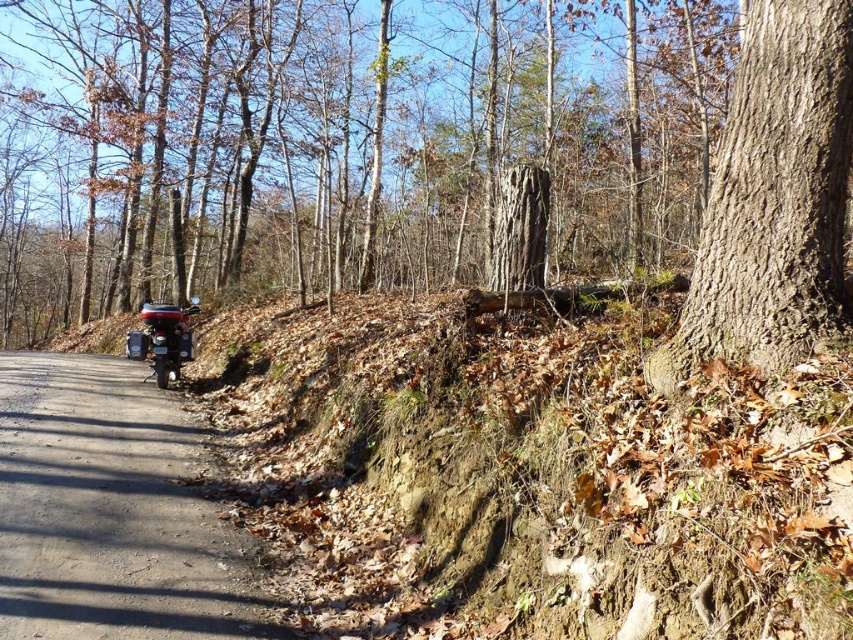
You are a hiker who needs to cross a narrow bridge that is exactly 8 meters long. You are currently standing next to the brown rough tree trunk at center right and want to reach the brown rough bark tree at right. Can you safely cross the bridge if it is placed between these two trees?

The distance between the brown rough tree trunk at center right and brown rough bark tree at right is 8.21 meters. Since the bridge is only 8 meters long, it would be 21 centimeters too short to span the gap between them. Therefore, you cannot safely cross the bridge in this scenario.

You are a hiker who wants to take a photo of both the brown rough tree trunk at center right and the brown rough bark tree at right. Which tree should you stand closer to in order to capture both in a single frame?

You should stand closer to the brown rough bark tree at right because it is shorter than the brown rough tree trunk at center right, allowing both to fit within the camera frame when positioned appropriately.

You are standing on the dirt path in the forest and want to take a photo of both the brown rough bark tree at right and the shiny metallic motorbike at lower left. Which object should you adjust your camera angle to look up at, and which one to look down at?

The brown rough bark tree at right is above the shiny metallic motorbike at lower left, so you should look up at the brown rough bark tree at right and look down at the shiny metallic motorbike at lower left.